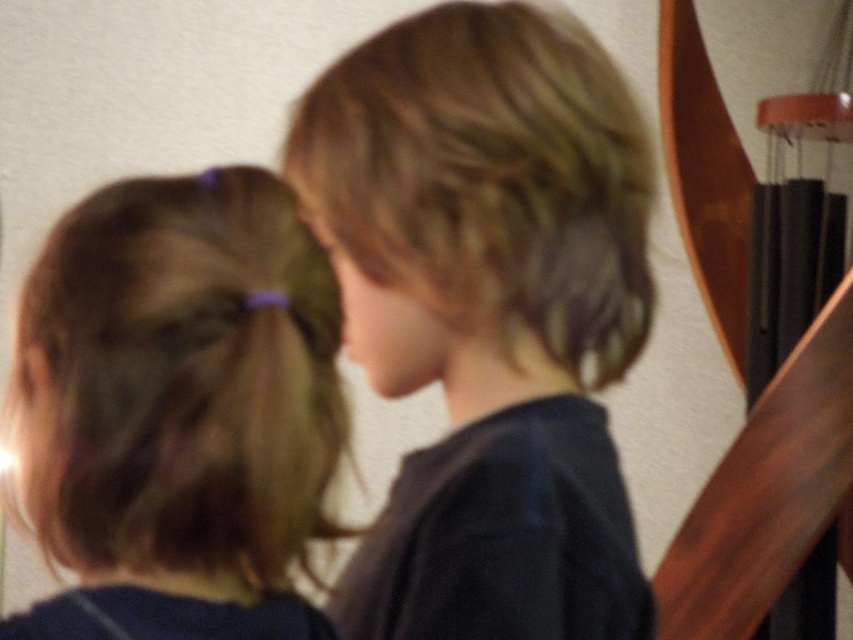
You are taking a photo and want to focus on both point (467, 49) and point (86, 212) in the image. Since the camera can only focus on one plane, which point should you prioritize to ensure at least one is in focus?

You should prioritize focusing on point (467, 49) because it is closer to the camera than point (86, 212). This way, the point closer to the camera will be in focus, and the other may still be somewhat in focus depending on the depth of field.

You are a photographer trying to capture a candid shot of two people in the scene. You notice the blonde hair at center and the brown hair at left. Which person should you focus on if you want to photograph the one closer to the right side of the frame?

The blonde hair at center is to the right of the brown hair at left, so you should focus on the blonde hair at center to photograph the person closer to the right side of the frame.

You are a photographer trying to capture a group photo of the blonde hair at center and the brown hair at left. Based on their heights, which person should stand in the back to avoid blocking the other?

The blonde hair at center is much taller than the brown hair at left, so the blonde hair at center should stand in the back to avoid blocking the shorter person.